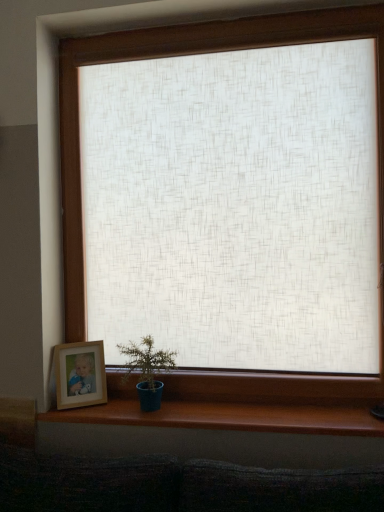
What do you see at coordinates (147, 370) in the screenshot? I see `blue matte pot at lower left` at bounding box center [147, 370].

You are a GUI agent. You are given a task and a screenshot of the screen. Output one action in this format:
    pyautogui.click(x=<x>, y=<y>)
    Task: Click on the brown wood at lower center
    Image resolution: width=384 pixels, height=512 pixels.
    Given the screenshot: What is the action you would take?
    pyautogui.click(x=228, y=417)

Considering the positions of objects brown wood at lower center and blue matte pot at lower left in the image provided, who is in front, brown wood at lower center or blue matte pot at lower left?

Positioned in front is brown wood at lower center.

Who is taller, brown wood at lower center or blue matte pot at lower left?

Standing taller between the two is blue matte pot at lower left.

Does brown wood at lower center contain blue matte pot at lower left?

Result: Actually, blue matte pot at lower left is outside brown wood at lower center.

Which object is wider, blue matte pot at lower left or brown wood at lower center?

Answer: Wider between the two is blue matte pot at lower left.

Considering the points (154, 386) and (265, 428), which point is in front, point (154, 386) or point (265, 428)?

The point (265, 428) is more forward.

Which is more to the left, blue matte pot at lower left or brown wood at lower center?

blue matte pot at lower left.

Considering the relative sizes of wooden picture frame at lower left and blue matte pot at lower left in the image provided, is wooden picture frame at lower left shorter than blue matte pot at lower left?

Indeed, wooden picture frame at lower left has a lesser height compared to blue matte pot at lower left.

From the image's perspective, is wooden picture frame at lower left above blue matte pot at lower left?

Incorrect, from the image's perspective, wooden picture frame at lower left is lower than blue matte pot at lower left.

Who is bigger, wooden picture frame at lower left or blue matte pot at lower left?

blue matte pot at lower left.

Measure the distance from wooden picture frame at lower left to blue matte pot at lower left.

wooden picture frame at lower left and blue matte pot at lower left are 7.65 inches apart from each other.

Which object is closer to the camera taking this photo, brown wood at lower center or wooden picture frame at lower left?

brown wood at lower center is in front.

Would you say brown wood at lower center is inside or outside wooden picture frame at lower left?

brown wood at lower center is outside wooden picture frame at lower left.

How different are the orientations of brown wood at lower center and wooden picture frame at lower left in degrees?

There is a 28.1-degree angle between the facing directions of brown wood at lower center and wooden picture frame at lower left.

Is brown wood at lower center not near wooden picture frame at lower left?

No.

Between blue matte pot at lower left and wooden picture frame at lower left, which one has smaller width?

Thinner between the two is wooden picture frame at lower left.

Which of these two, blue matte pot at lower left or wooden picture frame at lower left, is smaller?

wooden picture frame at lower left is smaller.

From the picture: Who is shorter, blue matte pot at lower left or wooden picture frame at lower left?

With less height is wooden picture frame at lower left.

Is brown wood at lower center at the back of wooden picture frame at lower left?

wooden picture frame at lower left is not turned away from brown wood at lower center.

From a real-world perspective, does wooden picture frame at lower left sit lower than brown wood at lower center?

Incorrect, from a real-world perspective, wooden picture frame at lower left is higher than brown wood at lower center.

Does wooden picture frame at lower left appear on the left side of brown wood at lower center?

Yes.

Locate an element on the screen. window sill below the blue matte pot at lower left (from the image's perspective) is located at coordinates (228, 417).

At what (x,y) coordinates should I click in order to perform the action: click on houseplant to the left of brown wood at lower center. Please return your answer as a coordinate pair (x, y). Image resolution: width=384 pixels, height=512 pixels. Looking at the image, I should click on (147, 370).

Which object lies nearer to the anchor point wooden picture frame at lower left, blue matte pot at lower left or brown wood at lower center?

Based on the image, blue matte pot at lower left appears to be nearer to wooden picture frame at lower left.

Which object lies nearer to the anchor point brown wood at lower center, wooden picture frame at lower left or blue matte pot at lower left?

blue matte pot at lower left.

From the image, which object appears to be farther from wooden picture frame at lower left, brown wood at lower center or blue matte pot at lower left?

brown wood at lower center is positioned further to the anchor wooden picture frame at lower left.

From the image, which object appears to be nearer to blue matte pot at lower left, wooden picture frame at lower left or brown wood at lower center?

wooden picture frame at lower left.

From the image, which object appears to be nearer to brown wood at lower center, blue matte pot at lower left or wooden picture frame at lower left?

Based on the image, blue matte pot at lower left appears to be nearer to brown wood at lower center.

Estimate the real-world distances between objects in this image. Which object is further from blue matte pot at lower left, brown wood at lower center or wooden picture frame at lower left?

The object further to blue matte pot at lower left is brown wood at lower center.

Identify the location of houseplant between wooden picture frame at lower left and brown wood at lower center in the horizontal direction. (147, 370).